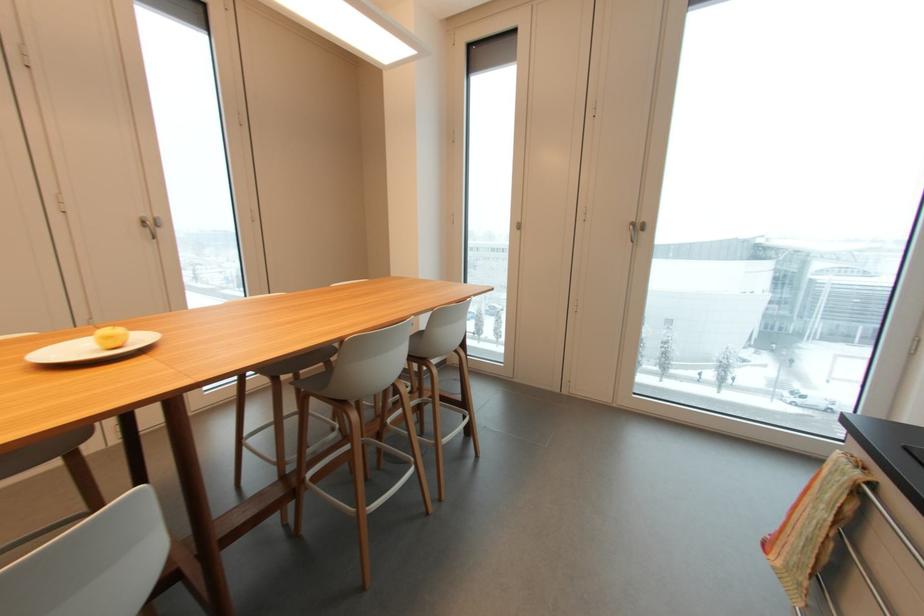
The height and width of the screenshot is (616, 924). Identify the location of metal drawer handle. (864, 573).